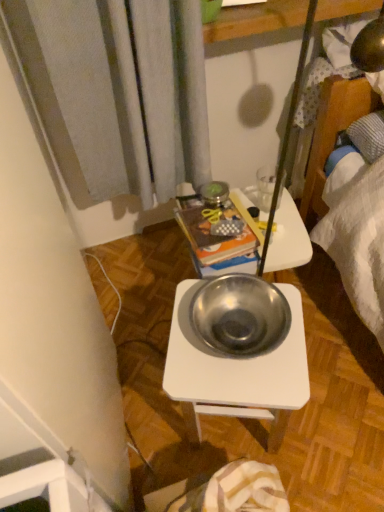
Question: Does metallic books at center come in front of metallic white desk at center?

Choices:
 (A) yes
 (B) no

Answer: (B)

Question: Can you confirm if metallic books at center is positioned to the right of metallic white desk at center?

Choices:
 (A) yes
 (B) no

Answer: (B)

Question: Is metallic books at center shorter than metallic white desk at center?

Choices:
 (A) yes
 (B) no

Answer: (A)

Question: Is metallic books at center facing away from metallic white desk at center?

Choices:
 (A) no
 (B) yes

Answer: (A)

Question: Does metallic books at center have a greater width compared to metallic white desk at center?

Choices:
 (A) yes
 (B) no

Answer: (B)

Question: From a real-world perspective, is metallic books at center above or below metallic silver bowl at center?

Choices:
 (A) below
 (B) above

Answer: (A)

Question: Do you think metallic books at center is within metallic silver bowl at center, or outside of it?

Choices:
 (A) outside
 (B) inside

Answer: (A)

Question: In terms of width, does metallic books at center look wider or thinner when compared to metallic silver bowl at center?

Choices:
 (A) wide
 (B) thin

Answer: (A)

Question: Considering the positions of metallic books at center and metallic silver bowl at center in the image, is metallic books at center taller or shorter than metallic silver bowl at center?

Choices:
 (A) tall
 (B) short

Answer: (A)

Question: Relative to transparent glass at upper center, is metallic silver bowl at center in front or behind?

Choices:
 (A) behind
 (B) front

Answer: (B)

Question: From the image's perspective, relative to transparent glass at upper center, is metallic silver bowl at center above or below?

Choices:
 (A) above
 (B) below

Answer: (B)

Question: In terms of width, does metallic silver bowl at center look wider or thinner when compared to transparent glass at upper center?

Choices:
 (A) wide
 (B) thin

Answer: (A)

Question: Do you think metallic silver bowl at center is within transparent glass at upper center, or outside of it?

Choices:
 (A) outside
 (B) inside

Answer: (A)

Question: Considering the positions of metallic white desk at center and metallic silver bowl at center in the image, is metallic white desk at center wider or thinner than metallic silver bowl at center?

Choices:
 (A) thin
 (B) wide

Answer: (B)

Question: From the image's perspective, relative to metallic silver bowl at center, is metallic white desk at center above or below?

Choices:
 (A) above
 (B) below

Answer: (B)